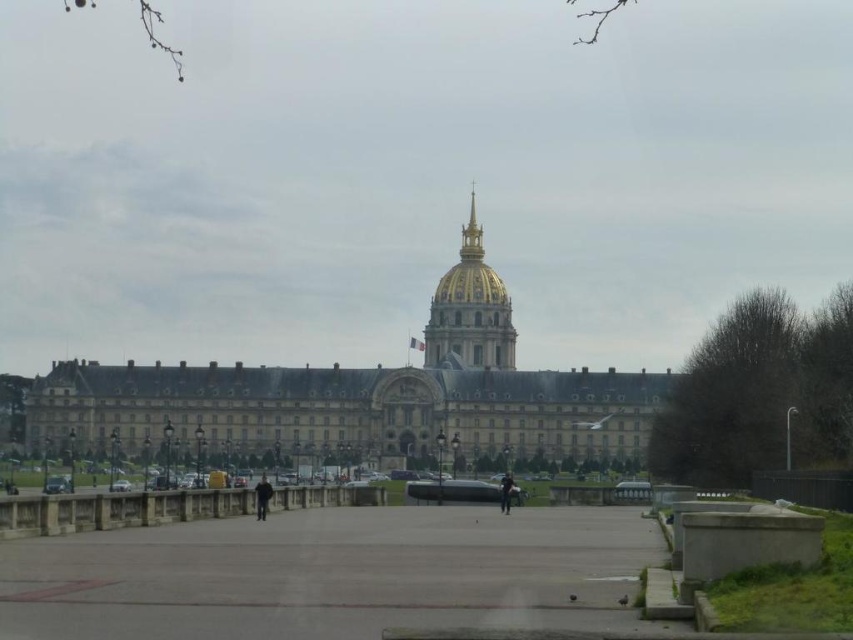
You are an architect analyzing the image of a historical building. You notice the dark gray stone building at center and the black matte jacket at center. Which object is closer to the viewer?

The black matte jacket at center is closer to the viewer because the dark gray stone building at center is positioned over it, indicating that the building is in the background.

You are standing in front of the grand architectural structure. Based on the coordinates provided, what is the color of the building at point (363, 397)?

The point (363, 397) corresponds to the dark gray stone building at center, so the color is dark gray.

You are standing in front of the grand building and want to take a photo. You notice two points marked on the building facade at coordinates point (490, 362) and point (270, 486). Which point is closer to your camera position?

Point (490, 362) is further to the camera than point (270, 486), so the closer point to the camera is point (270, 486).